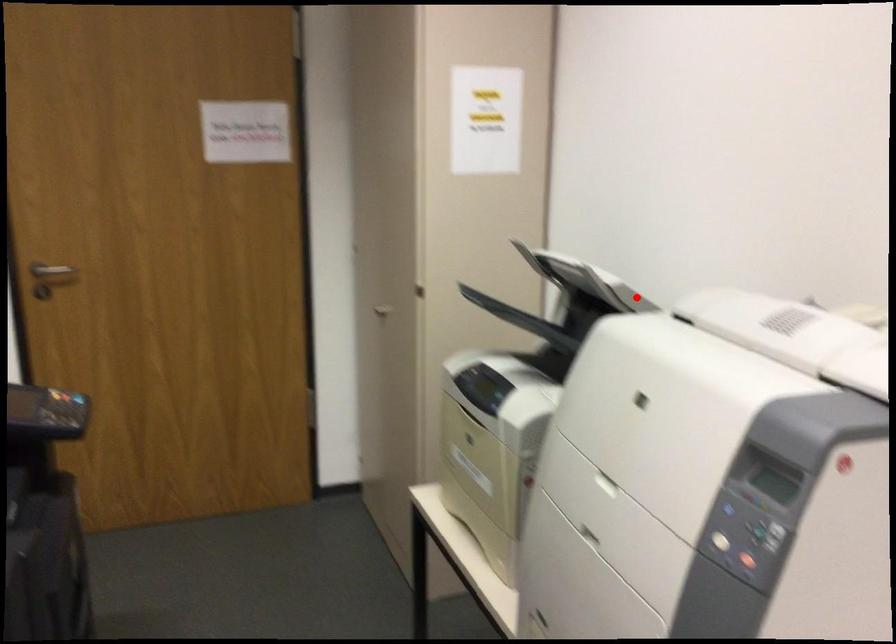
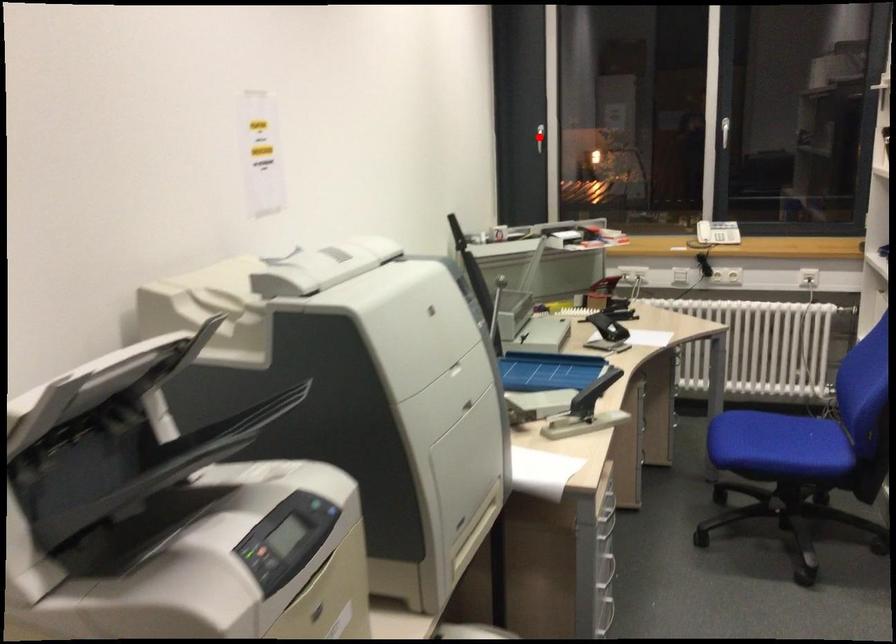
I am providing you with two images of the same scene from different viewpoints. A red point is marked on the first image and another point is marked on the second image. Does the point marked in image1 correspond to the same location as the one in image2?

No